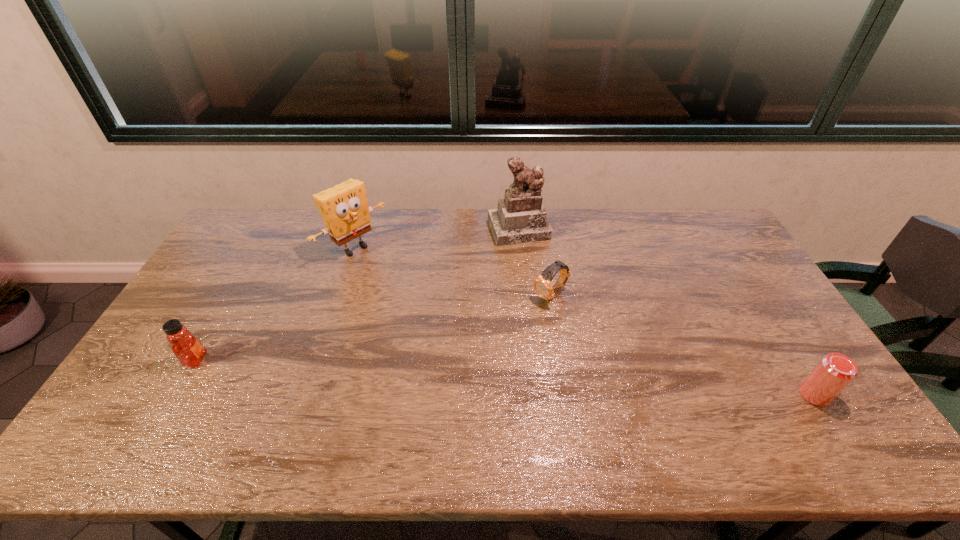
At what (x,y) coordinates should I click in order to perform the action: click on free point between the third nearest object and the sponge. Please return your answer as a coordinate pair (x, y). This screenshot has height=540, width=960. Looking at the image, I should click on (452, 272).

Identify the location of vacant point located between the rightmost object and the figurine. (666, 312).

Where is `free space between the honey and the third nearest object`? The image size is (960, 540). free space between the honey and the third nearest object is located at coordinates (373, 327).

This screenshot has height=540, width=960. Find the location of `vacant space that's between the watch and the fourth object from right to left`. vacant space that's between the watch and the fourth object from right to left is located at coordinates (452, 272).

You are a GUI agent. You are given a task and a screenshot of the screen. Output one action in this format:
    pyautogui.click(x=<x>, y=<y>)
    Task: Click on the vacant space that's between the tallest object and the third farthest object
    Image resolution: width=960 pixels, height=540 pixels.
    Given the screenshot: What is the action you would take?
    pyautogui.click(x=535, y=262)

At what (x,y) coordinates should I click in order to perform the action: click on empty location between the watch and the rightmost object. Please return your answer as a coordinate pair (x, y). Looking at the image, I should click on (683, 345).

Image resolution: width=960 pixels, height=540 pixels. I want to click on free spot between the fourth object from right to left and the honey, so click(276, 304).

You are a GUI agent. You are given a task and a screenshot of the screen. Output one action in this format:
    pyautogui.click(x=<x>, y=<y>)
    Task: Click on the vacant space that's between the nearest object and the figurine
    The image size is (960, 540).
    Given the screenshot: What is the action you would take?
    click(x=666, y=312)

Where is `vacant area that lies between the rightmost object and the fourth shortest object`? vacant area that lies between the rightmost object and the fourth shortest object is located at coordinates (585, 322).

Find the location of a particular element. The image size is (960, 540). empty space that is in between the honey and the figurine is located at coordinates (357, 295).